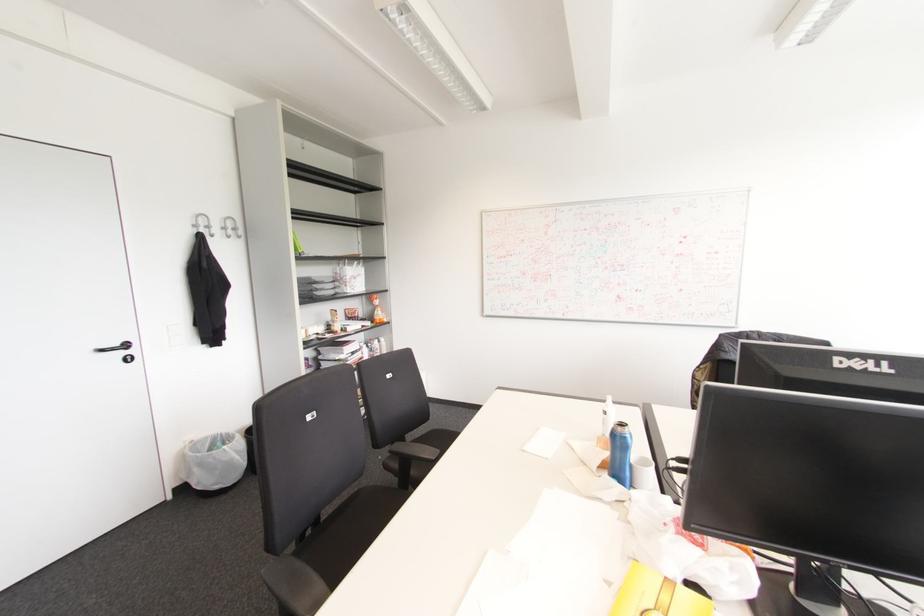
The image size is (924, 616). I want to click on small trash can, so click(x=213, y=462).